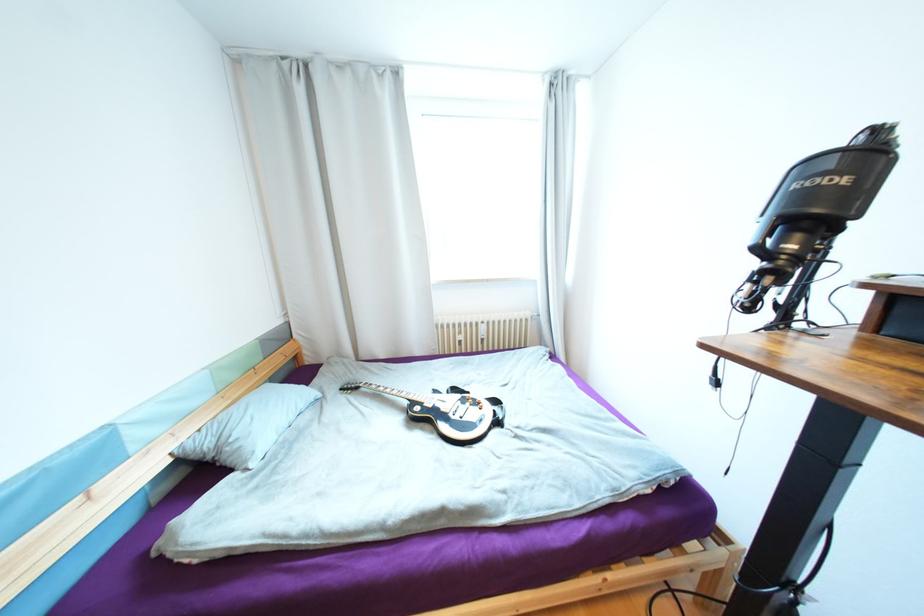
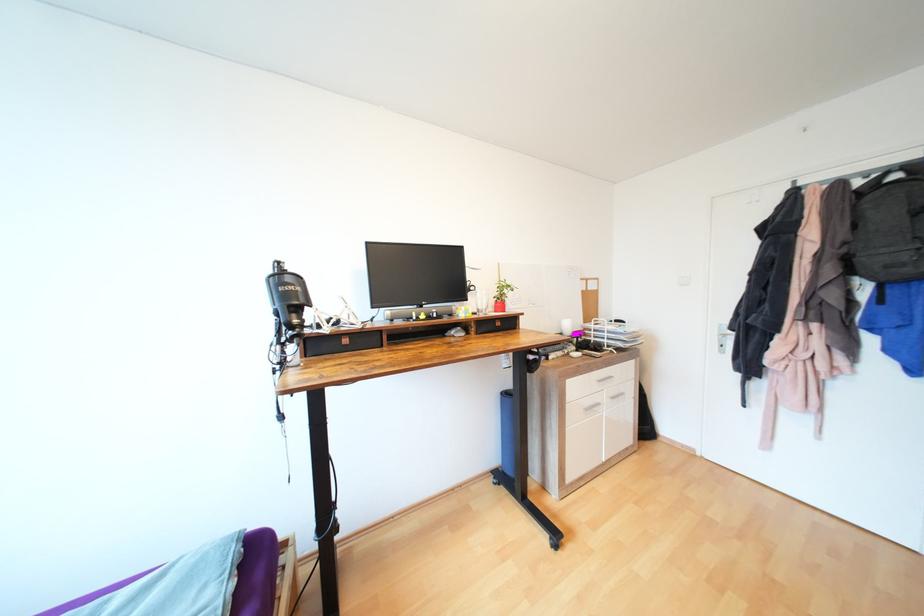
Question: The images are taken continuously from a first-person perspective. In which direction is your viewpoint rotating?

Choices:
 (A) Left
 (B) Right
 (C) Up
 (D) Down

Answer: (B)